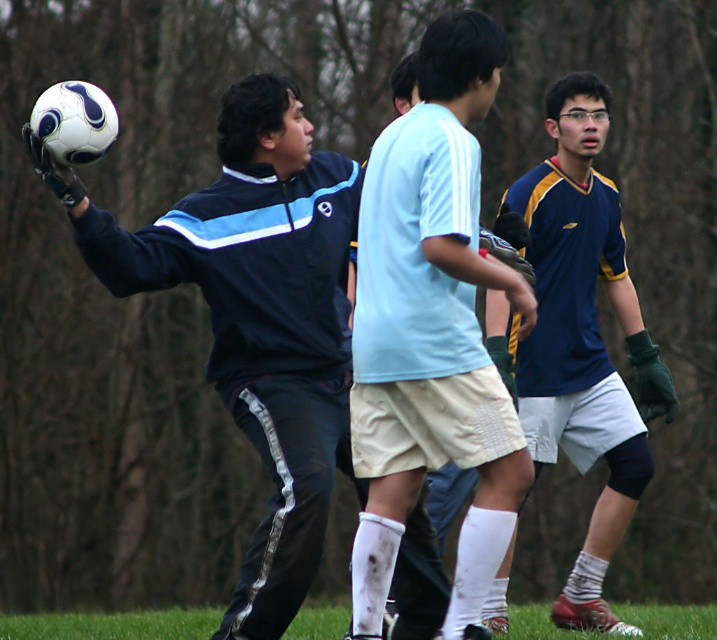
You are a soccer coach observing the game. You notice the light blue jersey at center and the matte black jacket at center. Which player is positioned closer to you?

The light blue jersey at center is closer to the viewer than the matte black jacket at center, so the player in the light blue jersey at center is positioned closer to you.

You are a soccer coach observing the game. You notice the matte black jacket at center and the green grass at lower center. Which object is positioned higher in the image?

The matte black jacket at center is above the green grass at lower center, so it is positioned higher in the image.

You are a photographer standing at the camera position. You want to take a closeup of the soccer ball. Which point, point 1 at coordinates [412,467] or point 2 at coordinates [313,627], is closer to your position?

Point 1 at coordinates [412,467] is closer to the camera than point 2 at coordinates [313,627], so you should focus on point 1 to capture the soccer ball in a closeup.